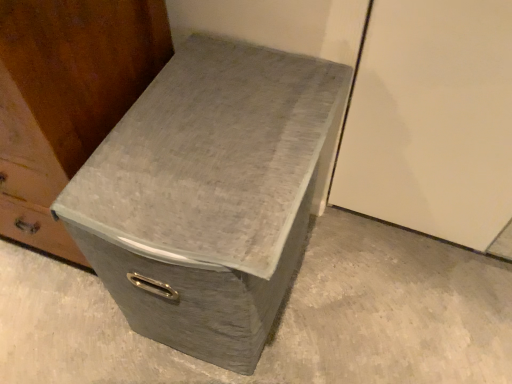
Where is `matte gray storage box at center`? Image resolution: width=512 pixels, height=384 pixels. matte gray storage box at center is located at coordinates (66, 98).

Is matte gray storage box at center not within gray fabric storage bin at center?

matte gray storage box at center is positioned outside gray fabric storage bin at center.

Considering the sizes of matte gray storage box at center and gray fabric storage bin at center in the image, is matte gray storage box at center taller or shorter than gray fabric storage bin at center?

Considering their sizes, matte gray storage box at center has more height than gray fabric storage bin at center.

Could you tell me if matte gray storage box at center is turned towards gray fabric storage bin at center?

No, matte gray storage box at center is not facing towards gray fabric storage bin at center.

Which object is further away from the camera taking this photo, gray fabric storage bin at center or matte gray storage box at center?

gray fabric storage bin at center is further away from the camera.

Consider the image. What's the angular difference between gray fabric storage bin at center and matte gray storage box at center's facing directions?

The facing directions of gray fabric storage bin at center and matte gray storage box at center are 90.2 degrees apart.

From the image's perspective, does gray fabric storage bin at center appear higher than matte gray storage box at center?

Actually, gray fabric storage bin at center appears below matte gray storage box at center in the image.

From the image's perspective, would you say gray fabric shoe box at center is positioned over gray fabric storage bin at center?

Correct, gray fabric shoe box at center appears higher than gray fabric storage bin at center in the image.

Is gray fabric shoe box at center to the right of gray fabric storage bin at center from the viewer's perspective?

Yes, gray fabric shoe box at center is to the right of gray fabric storage bin at center.

From a real-world perspective, between gray fabric shoe box at center and gray fabric storage bin at center, who is vertically higher?

From a 3D spatial view, gray fabric shoe box at center is above.

Does gray fabric shoe box at center lie behind gray fabric storage bin at center?

No, gray fabric shoe box at center is closer to the viewer.

Is gray fabric storage bin at center not near gray fabric shoe box at center?

No, gray fabric storage bin at center is not far away from gray fabric shoe box at center.

Between gray fabric storage bin at center and gray fabric shoe box at center, which one appears on the right side from the viewer's perspective?

From the viewer's perspective, gray fabric shoe box at center appears more on the right side.

How far apart are gray fabric storage bin at center and gray fabric shoe box at center?

gray fabric storage bin at center and gray fabric shoe box at center are 18.58 inches apart from each other.

Is gray fabric storage bin at center turned away from gray fabric shoe box at center?

No, gray fabric shoe box at center is not at the back of gray fabric storage bin at center.

In terms of width, does gray fabric shoe box at center look wider or thinner when compared to matte gray storage box at center?

In the image, gray fabric shoe box at center appears to be wider than matte gray storage box at center.

Based on the photo, is gray fabric shoe box at center oriented towards matte gray storage box at center?

No, gray fabric shoe box at center is not facing towards matte gray storage box at center.

From a real-world perspective, is gray fabric shoe box at center on top of matte gray storage box at center?

Incorrect, from a real-world perspective, gray fabric shoe box at center is lower than matte gray storage box at center.

Between gray fabric shoe box at center and matte gray storage box at center, which one appears on the right side from the viewer's perspective?

gray fabric shoe box at center is more to the right.

From the image's perspective, is matte gray storage box at center above or below gray fabric shoe box at center?

From the image's perspective, matte gray storage box at center appears above gray fabric shoe box at center.

Can you tell me how much matte gray storage box at center and gray fabric shoe box at center differ in facing direction?

0.227 degrees separate the facing orientations of matte gray storage box at center and gray fabric shoe box at center.

Is matte gray storage box at center to the left or to the right of gray fabric shoe box at center in the image?

matte gray storage box at center is to the left of gray fabric shoe box at center.

Image resolution: width=512 pixels, height=384 pixels. Find the location of `furniture in front of the gray fabric storage bin at center`. furniture in front of the gray fabric storage bin at center is located at coordinates (66, 98).

You are a GUI agent. You are given a task and a screenshot of the screen. Output one action in this format:
    pyautogui.click(x=<x>, y=<y>)
    Task: Click on the furniture on the left of gray fabric storage bin at center
    Image resolution: width=512 pixels, height=384 pixels.
    Given the screenshot: What is the action you would take?
    pyautogui.click(x=66, y=98)

When comparing their distances from matte gray storage box at center, does gray fabric shoe box at center or gray fabric storage bin at center seem closer?

The object closer to matte gray storage box at center is gray fabric shoe box at center.

When comparing their distances from gray fabric storage bin at center, does gray fabric shoe box at center or matte gray storage box at center seem closer?

Among the two, gray fabric shoe box at center is located nearer to gray fabric storage bin at center.

Considering their positions, is gray fabric storage bin at center positioned further to matte gray storage box at center than gray fabric shoe box at center?

gray fabric storage bin at center is further to matte gray storage box at center.

Which object lies further to the anchor point gray fabric shoe box at center, matte gray storage box at center or gray fabric storage bin at center?

gray fabric storage bin at center is further to gray fabric shoe box at center.

When comparing their distances from gray fabric shoe box at center, does gray fabric storage bin at center or matte gray storage box at center seem further?

The object further to gray fabric shoe box at center is gray fabric storage bin at center.

Estimate the real-world distances between objects in this image. Which object is closer to gray fabric storage bin at center, matte gray storage box at center or gray fabric shoe box at center?

gray fabric shoe box at center is positioned closer to the anchor gray fabric storage bin at center.

In order to click on concrete located between matte gray storage box at center and gray fabric shoe box at center in the left-right direction in this screenshot , I will do `click(282, 318)`.